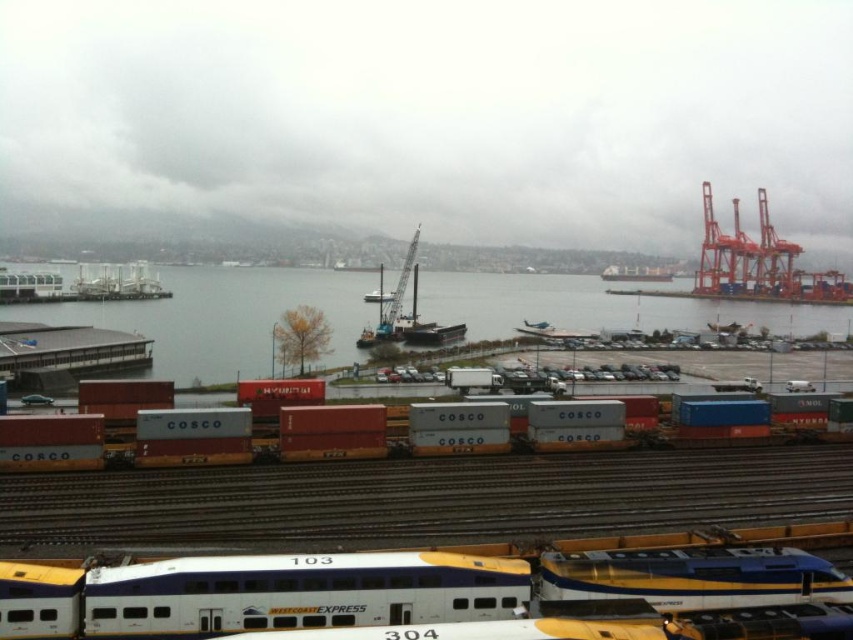
Does point (167, 344) come behind point (74, 365)?

That is True.

Is clear water at lower left behind metallic gray dock at lower left?

Yes, clear water at lower left is further from the viewer.

Which is behind, point (270, 304) or point (61, 346)?

Positioned behind is point (270, 304).

Identify the location of clear water at lower left. (223, 317).

Is white glossy train at center thinner than metallic gray dock at lower left?

No, white glossy train at center is not thinner than metallic gray dock at lower left.

Describe the element at coordinates (256, 593) in the screenshot. I see `white glossy train at center` at that location.

Is point (225, 611) positioned in front of point (73, 346)?

Yes.

Locate an element on the screen. Image resolution: width=853 pixels, height=640 pixels. white glossy train at center is located at coordinates (256, 593).

Which of these two, metallic brown train track at lower center or white glossy train at center, stands taller?

Standing taller between the two is white glossy train at center.

Between metallic brown train track at lower center and white glossy train at center, which one appears on the right side from the viewer's perspective?

From the viewer's perspective, metallic brown train track at lower center appears more on the right side.

Locate an element on the screen. The width and height of the screenshot is (853, 640). metallic brown train track at lower center is located at coordinates (431, 499).